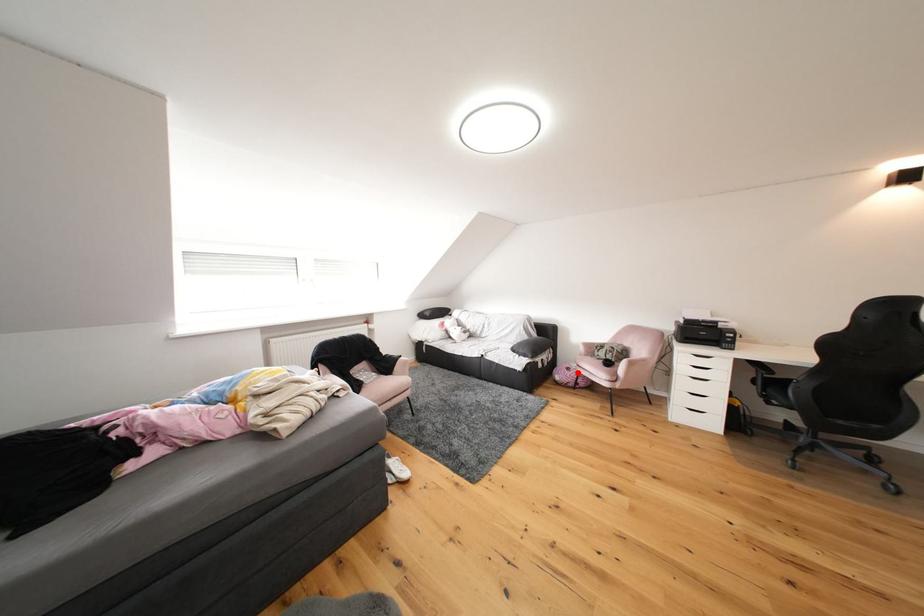
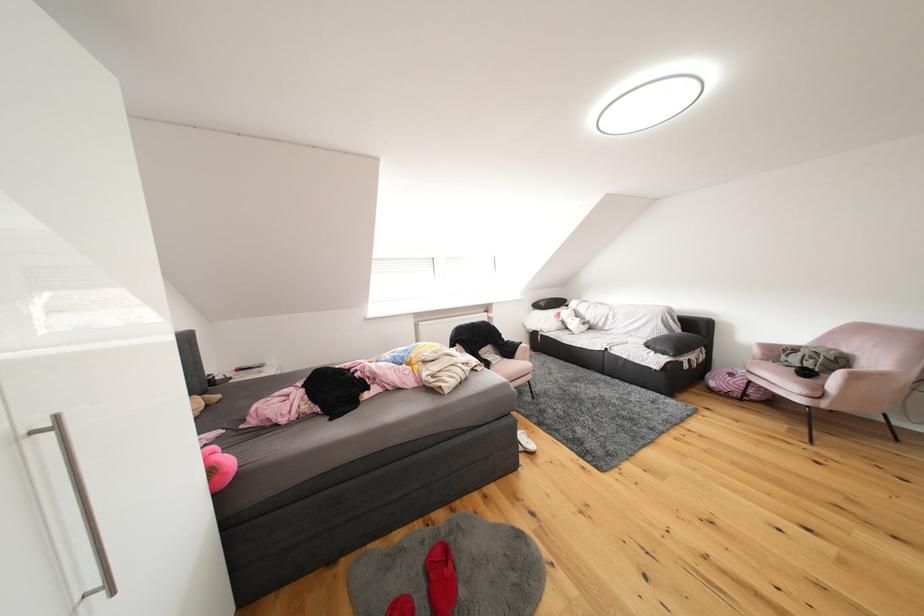
Question: I am providing you with two images of the same scene from different viewpoints. In image1, a red point is highlighted. Considering the same 3D point in image2, which of the following is correct?

Choices:
 (A) It is closer
 (B) It is farther

Answer: (A)